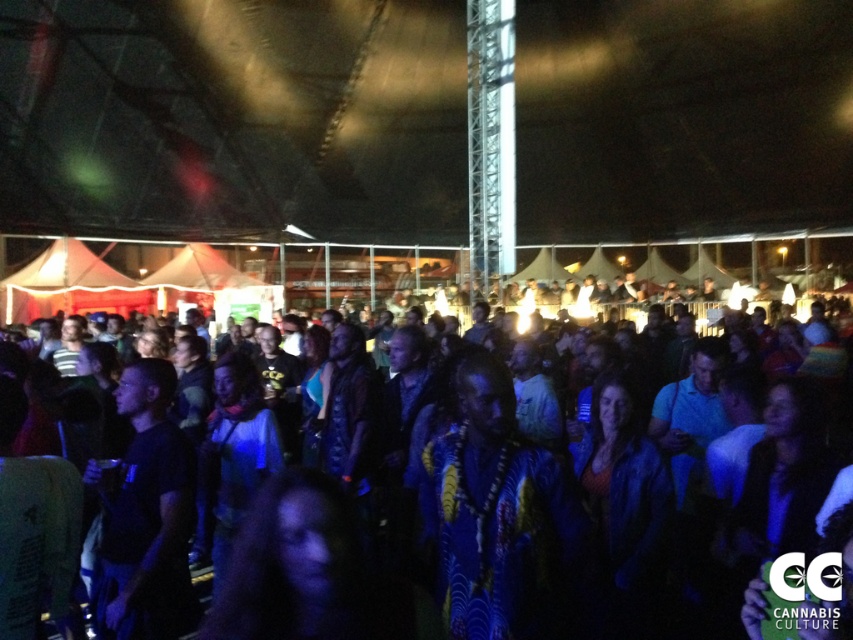
Looking at this image, can you confirm if dark blue fabric crowd at center is positioned above printed fabric shirt at center?

No, dark blue fabric crowd at center is not above printed fabric shirt at center.

Which of these two, dark blue fabric crowd at center or printed fabric shirt at center, stands shorter?

dark blue fabric crowd at center

Does point (633, 493) come in front of point (471, 566)?

That is False.

At what (x,y) coordinates should I click in order to perform the action: click on dark blue fabric crowd at center. Please return your answer as a coordinate pair (x, y). This screenshot has height=640, width=853. Looking at the image, I should click on (677, 497).

Is printed fabric shirt at center behind dark blue t-shirt at center?

No, it is in front of dark blue t-shirt at center.

Does point (496, 476) lie behind point (170, 547)?

No, (496, 476) is closer to viewer.

This screenshot has height=640, width=853. What do you see at coordinates (500, 516) in the screenshot?
I see `printed fabric shirt at center` at bounding box center [500, 516].

Image resolution: width=853 pixels, height=640 pixels. I want to click on printed fabric shirt at center, so click(x=500, y=516).

Measure the distance between dark blue fabric crowd at center and camera.

dark blue fabric crowd at center and camera are 3.58 meters apart from each other.

Can you confirm if dark blue fabric crowd at center is wider than dark blue t-shirt at center?

Yes, dark blue fabric crowd at center is wider than dark blue t-shirt at center.

The height and width of the screenshot is (640, 853). What do you see at coordinates (677, 497) in the screenshot? I see `dark blue fabric crowd at center` at bounding box center [677, 497].

What are the coordinates of `dark blue fabric crowd at center` in the screenshot? It's located at (677, 497).